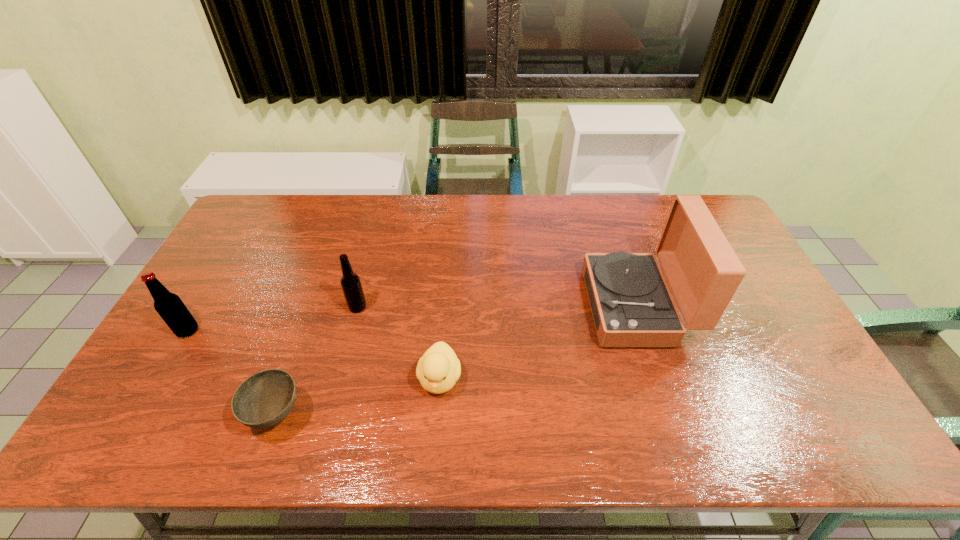
The height and width of the screenshot is (540, 960). In order to click on the rightmost object in this screenshot , I will do `click(632, 306)`.

At what (x,y) coordinates should I click in order to perform the action: click on the tallest object. Please return your answer as a coordinate pair (x, y). The height and width of the screenshot is (540, 960). Looking at the image, I should click on (632, 306).

At what (x,y) coordinates should I click in order to perform the action: click on the leftmost object. Please return your answer as a coordinate pair (x, y). The width and height of the screenshot is (960, 540). Looking at the image, I should click on (169, 306).

Where is `the left beer bottle`? the left beer bottle is located at coordinates (169, 306).

The height and width of the screenshot is (540, 960). I want to click on the right beer bottle, so click(x=351, y=285).

Locate an element on the screen. The width and height of the screenshot is (960, 540). the third object from left to right is located at coordinates (351, 285).

Locate an element on the screen. This screenshot has width=960, height=540. duck is located at coordinates (438, 369).

What are the coordinates of `the fourth tallest object` in the screenshot? It's located at (438, 369).

At what (x,y) coordinates should I click in order to perform the action: click on the shortest object. Please return your answer as a coordinate pair (x, y). The image size is (960, 540). Looking at the image, I should click on (266, 398).

This screenshot has width=960, height=540. Identify the location of the second object from left to right. (266, 398).